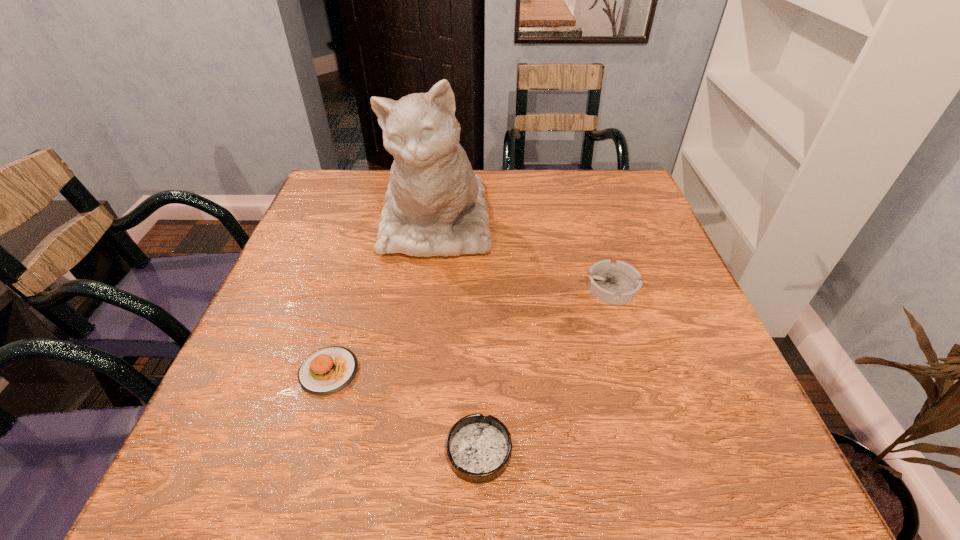
Locate an element on the screen. The height and width of the screenshot is (540, 960). object at the far edge is located at coordinates (435, 206).

This screenshot has height=540, width=960. In order to click on object that is positioned at the near edge in this screenshot , I will do `click(479, 448)`.

Image resolution: width=960 pixels, height=540 pixels. In order to click on object that is at the left edge in this screenshot , I will do `click(327, 370)`.

You are a GUI agent. You are given a task and a screenshot of the screen. Output one action in this format:
    pyautogui.click(x=<x>, y=<y>)
    Task: Click on the object located in the right edge section of the desktop
    Image resolution: width=960 pixels, height=540 pixels.
    Given the screenshot: What is the action you would take?
    pyautogui.click(x=617, y=284)

Image resolution: width=960 pixels, height=540 pixels. Identify the location of free spot at the far edge of the desktop. (569, 199).

This screenshot has height=540, width=960. In the image, there is a desktop. Identify the location of vacant space at the near edge. (399, 480).

The width and height of the screenshot is (960, 540). In the image, there is a desktop. What are the coordinates of `free region at the left edge` in the screenshot? It's located at (328, 303).

Locate an element on the screen. The image size is (960, 540). vacant region at the right edge of the desktop is located at coordinates (606, 256).

I want to click on vacant area at the far left corner, so click(373, 186).

Where is `vacant space at the near left corner`? This screenshot has height=540, width=960. vacant space at the near left corner is located at coordinates (218, 453).